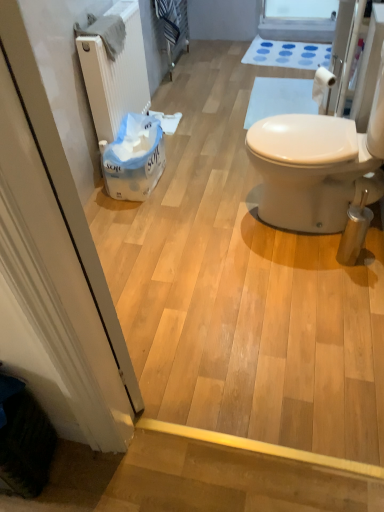
You are a GUI agent. You are given a task and a screenshot of the screen. Output one action in this format:
    pyautogui.click(x=<x>, y=<y>)
    Task: Click on the free point above white rubber bath mat at upper center (from a real-world perspective)
    
    Given the screenshot: What is the action you would take?
    pyautogui.click(x=287, y=51)